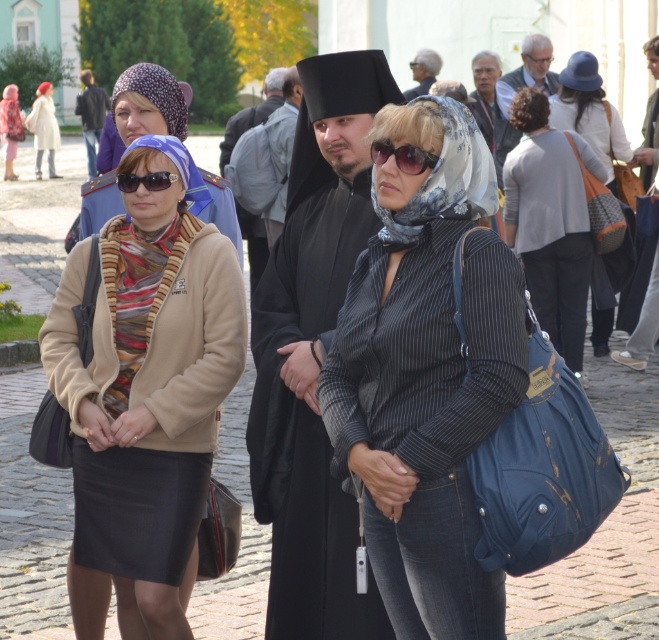
Is striped scarf at center positioned in front of gray hair at upper right?

Yes, it is.

Can you confirm if striped scarf at center is wider than gray hair at upper right?

Correct, the width of striped scarf at center exceeds that of gray hair at upper right.

The width and height of the screenshot is (659, 640). In order to click on striped scarf at center in this screenshot , I will do `click(150, 104)`.

Does sunglasses at center appear under gray hair at upper center?

Yes, sunglasses at center is below gray hair at upper center.

Can you confirm if sunglasses at center is shorter than gray hair at upper center?

Yes, sunglasses at center is shorter than gray hair at upper center.

At what (x,y) coordinates should I click in order to perform the action: click on sunglasses at center. Please return your answer as a coordinate pair (x, y). Looking at the image, I should click on (403, 156).

Who is taller, striped wool scarf at center or sunglasses at center?

With more height is striped wool scarf at center.

Can you confirm if striped wool scarf at center is positioned to the left of sunglasses at center?

Yes, striped wool scarf at center is to the left of sunglasses at center.

Does point (127, 323) come behind point (405, 145)?

Yes, point (127, 323) is farther from viewer.

Locate an element on the screen. striped wool scarf at center is located at coordinates (136, 291).